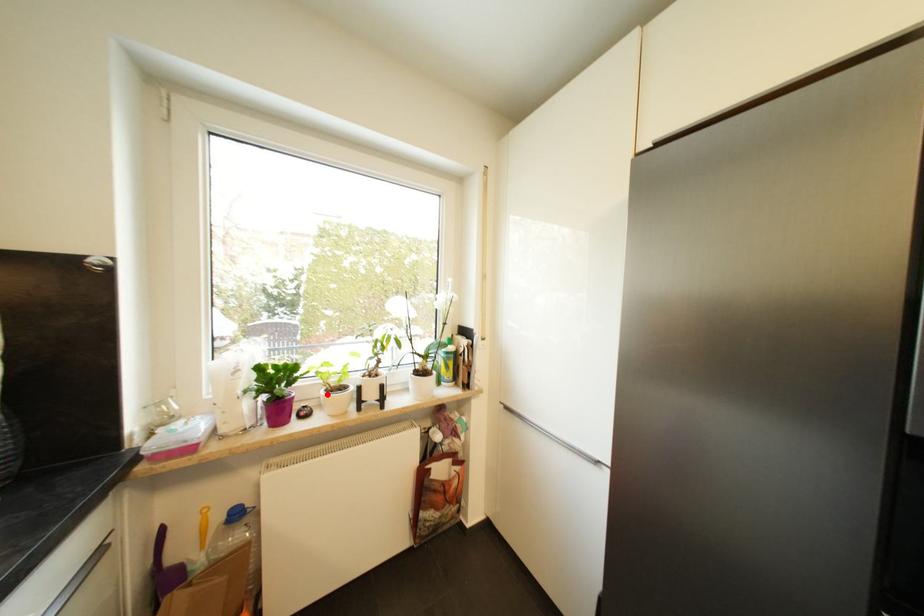
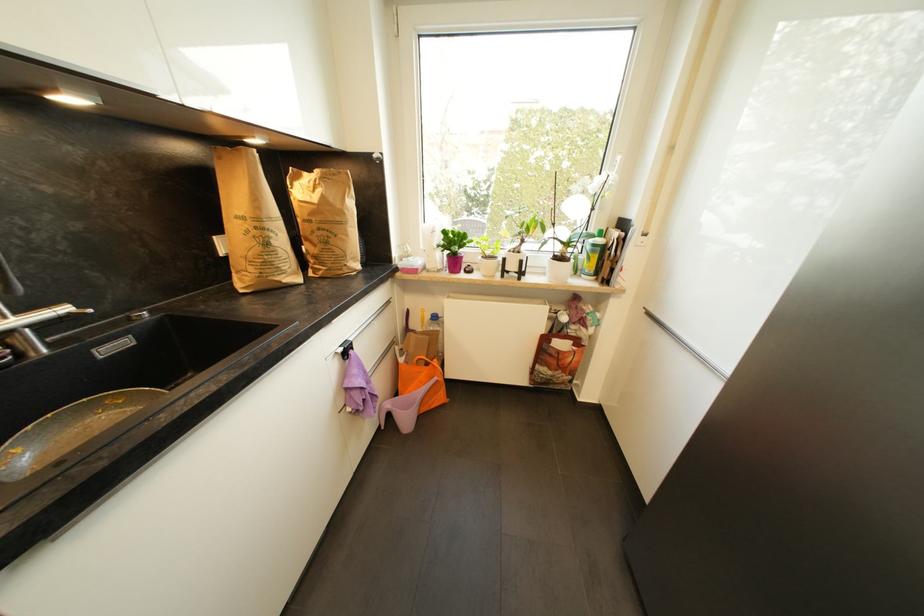
Where in the second image is the point corresponding to the highlighted location from the first image?

(484, 259)